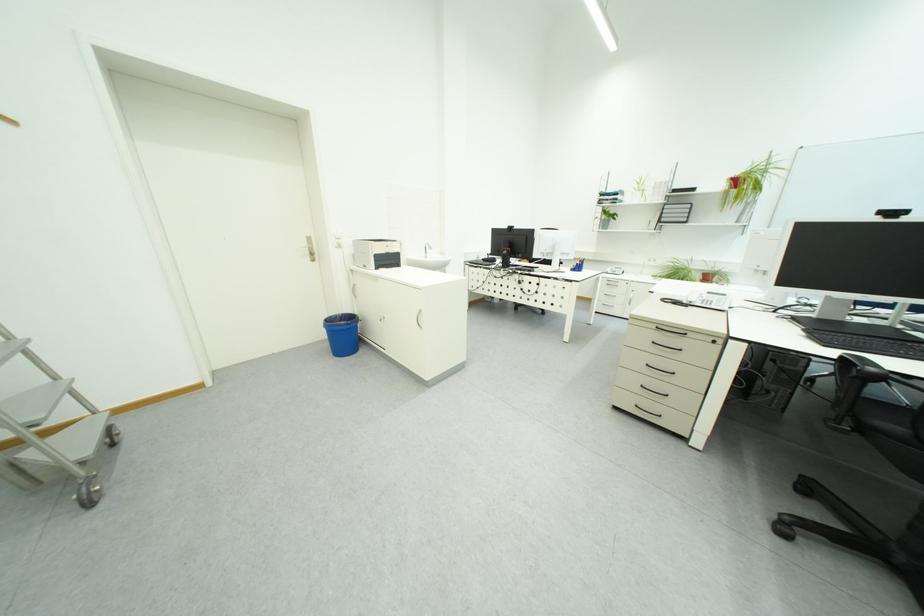
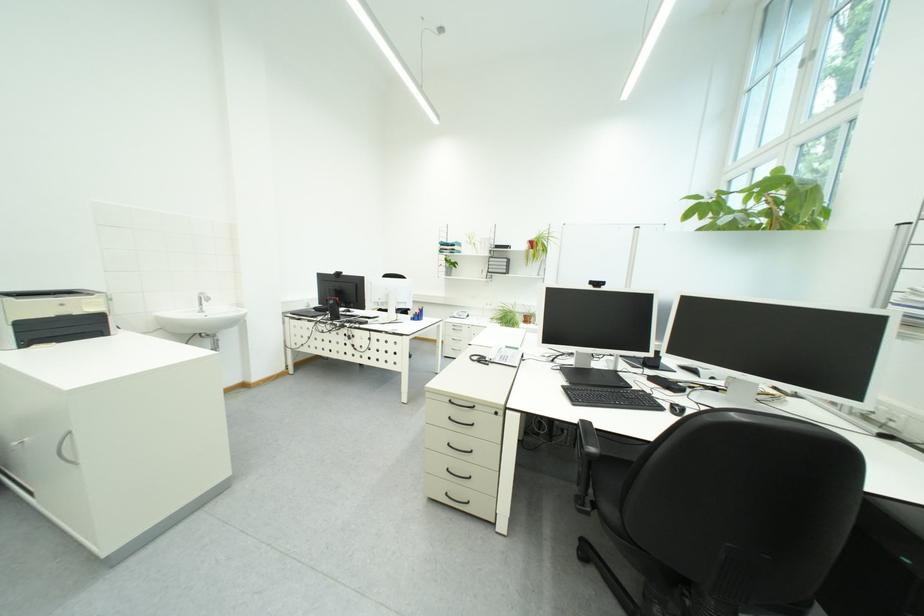
The point at (688, 304) is marked in the first image. Where is the corresponding point in the second image?

(492, 362)